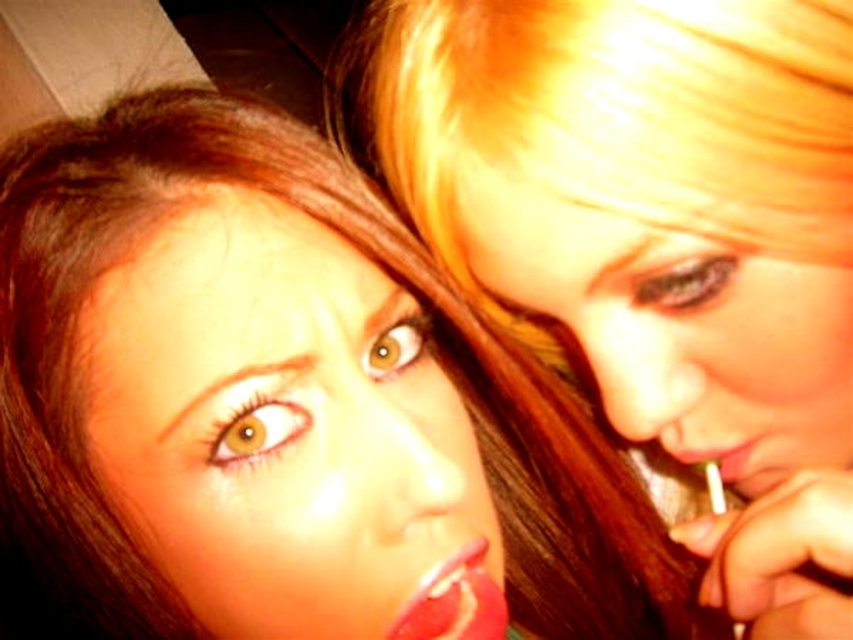
You are taking a photo of two people in a close position. You want to focus on the person closer to the camera. Which point should you focus on, point (103, 460) or point (839, 305)?

You should focus on point (103, 460) because it is closer to the camera than point (839, 305).

You are a makeup artist trying to choose between two shiny red lipsticks. You see the shiny red lipstick at center and the shiny red lipstick at lower right in the image. Which one is bigger?

The shiny red lipstick at center is larger in size than the shiny red lipstick at lower right.

You are a photographer using a camera with a focal length of 50mm. You want to capture a close portrait of the smooth skin face at upper right. Given that the ideal distance for this focal length is between 60 to 100 inches to avoid distortion, is the current distance sufficient?

The smooth skin face at upper right and camera are 12.26 inches apart, which is much closer than the ideal 60 to 100 inches range. This distance would likely cause significant distortion in the portrait.